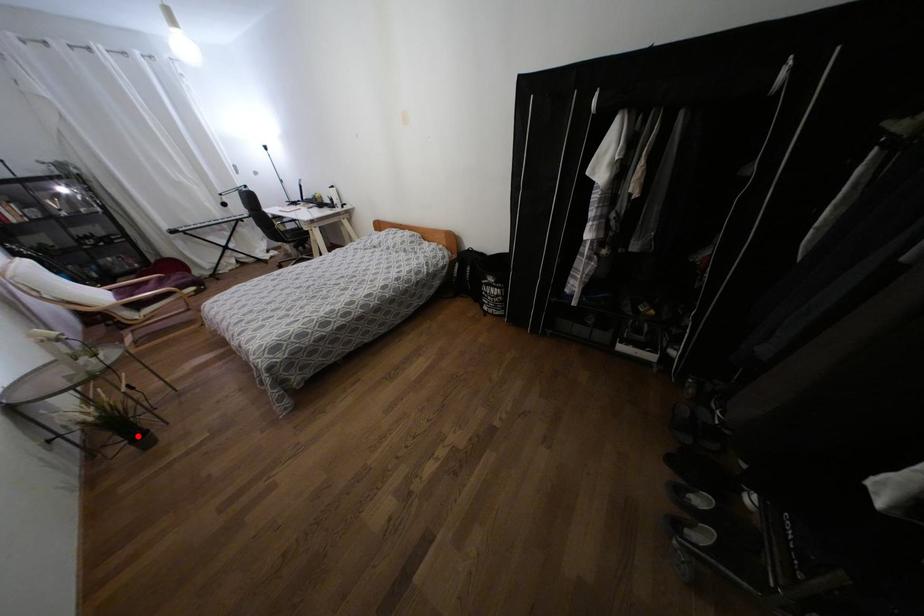
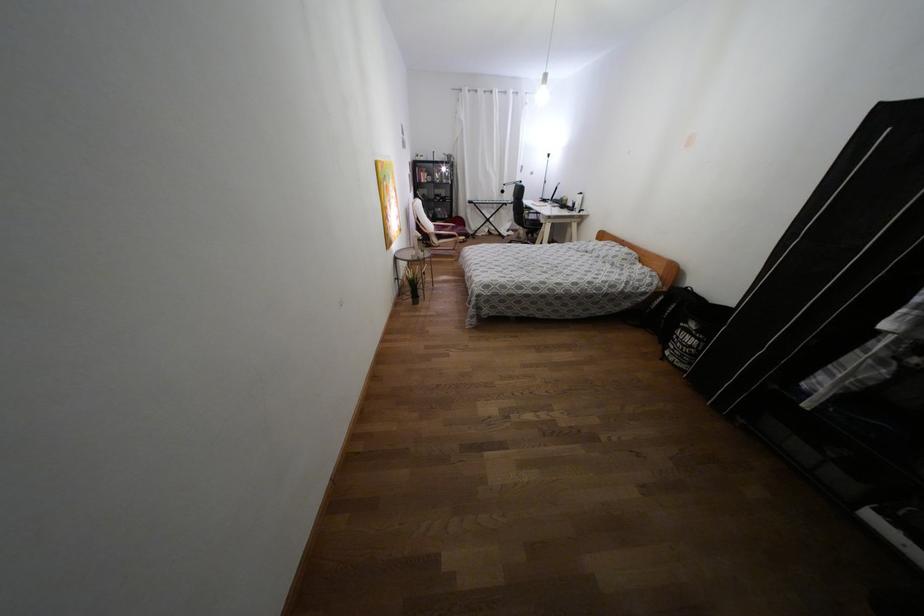
The point at the highlighted location is marked in the first image. Where is the corresponding point in the second image?

(415, 296)